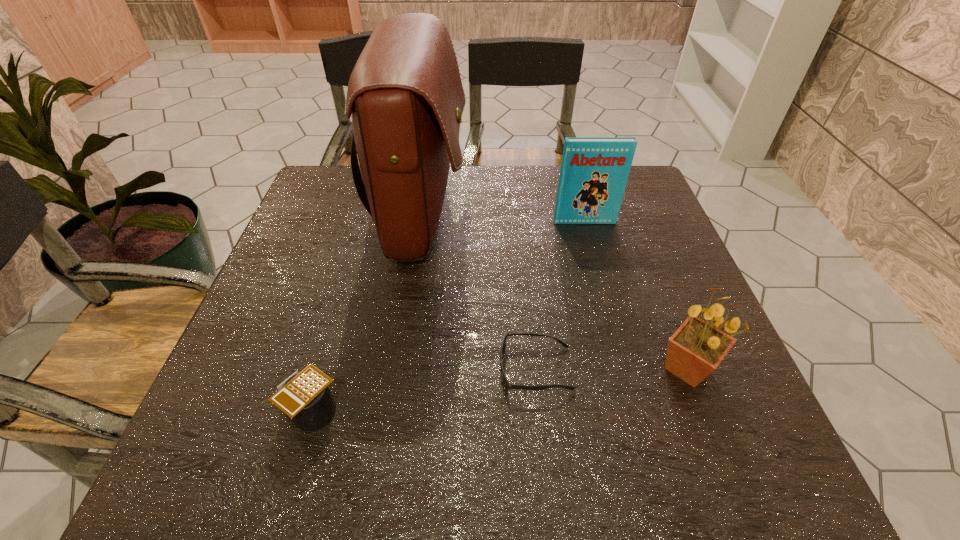
The height and width of the screenshot is (540, 960). I want to click on the tallest object, so click(x=405, y=94).

You are a GUI agent. You are given a task and a screenshot of the screen. Output one action in this format:
    pyautogui.click(x=<x>, y=<y>)
    Task: Click on the book
    Image resolution: width=960 pixels, height=540 pixels.
    Given the screenshot: What is the action you would take?
    pyautogui.click(x=594, y=171)

Identify the location of sunflower. Image resolution: width=960 pixels, height=540 pixels. (695, 350).

Where is `calculator`? The height and width of the screenshot is (540, 960). calculator is located at coordinates (305, 397).

This screenshot has height=540, width=960. I want to click on the shortest object, so click(507, 385).

Where is `the third object from right to left`? the third object from right to left is located at coordinates (507, 385).

The image size is (960, 540). Find the location of `vacant space situated 0.320m on the open flap of the tallest object`. vacant space situated 0.320m on the open flap of the tallest object is located at coordinates (588, 217).

Locate an element on the screen. vacant region located on the front cover of the book is located at coordinates (602, 285).

I want to click on vacant position located 0.150m at the front of the sunflower with flowers visible, so click(732, 483).

Locate an element on the screen. The width and height of the screenshot is (960, 540). vacant space located on the back of the fourth tallest object is located at coordinates (357, 255).